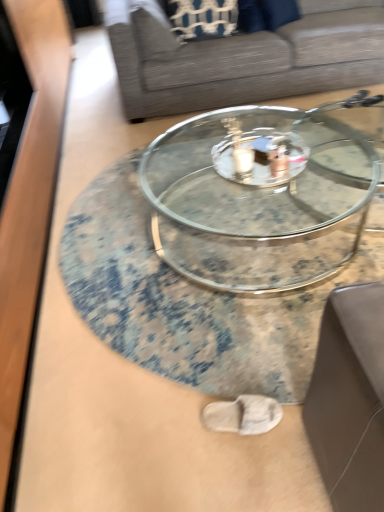
Question: Does gray fabric couch at center have a lesser width compared to clear glass coffee table at center, the 2th coffee table from the front?

Choices:
 (A) yes
 (B) no

Answer: (A)

Question: Is gray fabric couch at center completely or partially outside of clear glass coffee table at center, the 1th coffee table when ordered from back to front?

Choices:
 (A) no
 (B) yes

Answer: (B)

Question: Does gray fabric couch at center have a greater width compared to clear glass coffee table at center, the 2th coffee table from the front?

Choices:
 (A) yes
 (B) no

Answer: (B)

Question: From a real-world perspective, is gray fabric couch at center on clear glass coffee table at center, the 2th coffee table from the front?

Choices:
 (A) no
 (B) yes

Answer: (B)

Question: Can you confirm if gray fabric couch at center is smaller than clear glass coffee table at center, the 1th coffee table when ordered from back to front?

Choices:
 (A) no
 (B) yes

Answer: (A)

Question: Can you confirm if gray fabric couch at center is positioned to the right of clear glass coffee table at center, the 1th coffee table when ordered from back to front?

Choices:
 (A) yes
 (B) no

Answer: (A)

Question: Is clear glass coffee table at center, the 1th coffee table when ordered from back to front, far away from transparent glass coffee table at center, the first coffee table viewed from the front?

Choices:
 (A) yes
 (B) no

Answer: (B)

Question: Is the depth of clear glass coffee table at center, the 2th coffee table from the front, greater than that of transparent glass coffee table at center, marked as the 2th coffee table in a back-to-front arrangement?

Choices:
 (A) no
 (B) yes

Answer: (B)

Question: Does clear glass coffee table at center, the 2th coffee table from the front, have a lesser height compared to transparent glass coffee table at center, the first coffee table viewed from the front?

Choices:
 (A) yes
 (B) no

Answer: (B)

Question: From the image's perspective, does clear glass coffee table at center, the 2th coffee table from the front, appear higher than transparent glass coffee table at center, marked as the 2th coffee table in a back-to-front arrangement?

Choices:
 (A) no
 (B) yes

Answer: (B)

Question: Could transparent glass coffee table at center, the first coffee table viewed from the front, be considered to be inside clear glass coffee table at center, the 1th coffee table when ordered from back to front?

Choices:
 (A) yes
 (B) no

Answer: (B)

Question: From a real-world perspective, is clear glass coffee table at center, the 2th coffee table from the front, located higher than transparent glass coffee table at center, marked as the 2th coffee table in a back-to-front arrangement?

Choices:
 (A) yes
 (B) no

Answer: (A)

Question: Is transparent glass coffee table at center, marked as the 2th coffee table in a back-to-front arrangement, positioned far away from gray fabric couch at center?

Choices:
 (A) no
 (B) yes

Answer: (B)